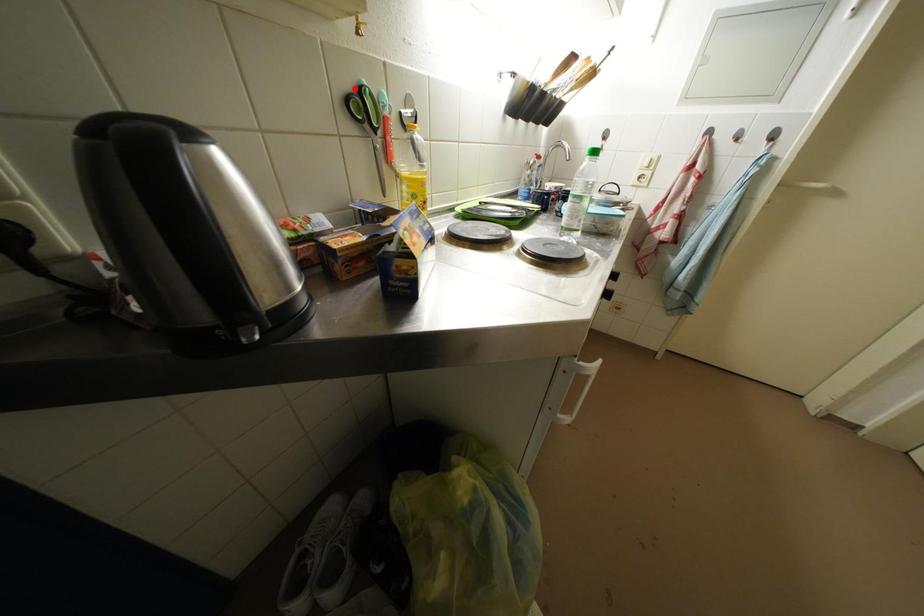
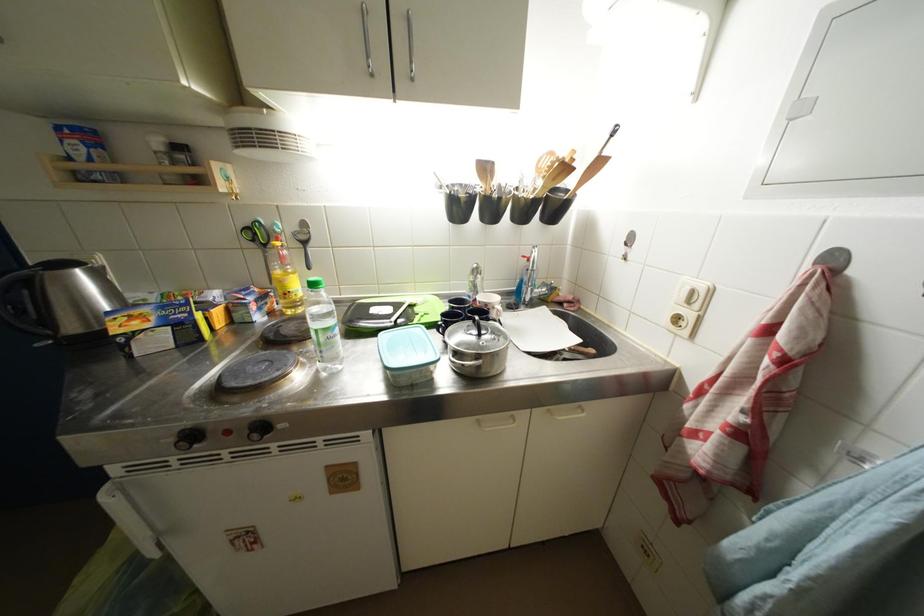
Where in the second image is the point corresponding to the highlighted location from the first image?

(253, 227)